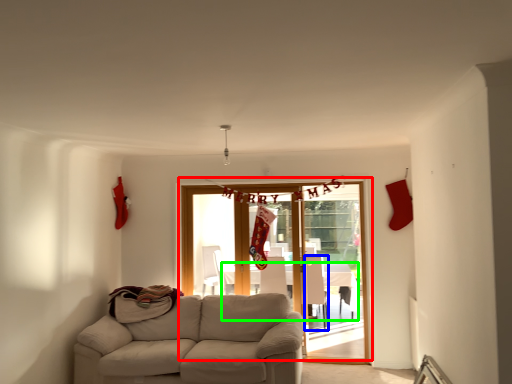
Question: Which object is the closest to the door (highlighted by a red box)? Choose among these: armchair (highlighted by a blue box) or table (highlighted by a green box).

Choices:
 (A) armchair
 (B) table

Answer: (A)